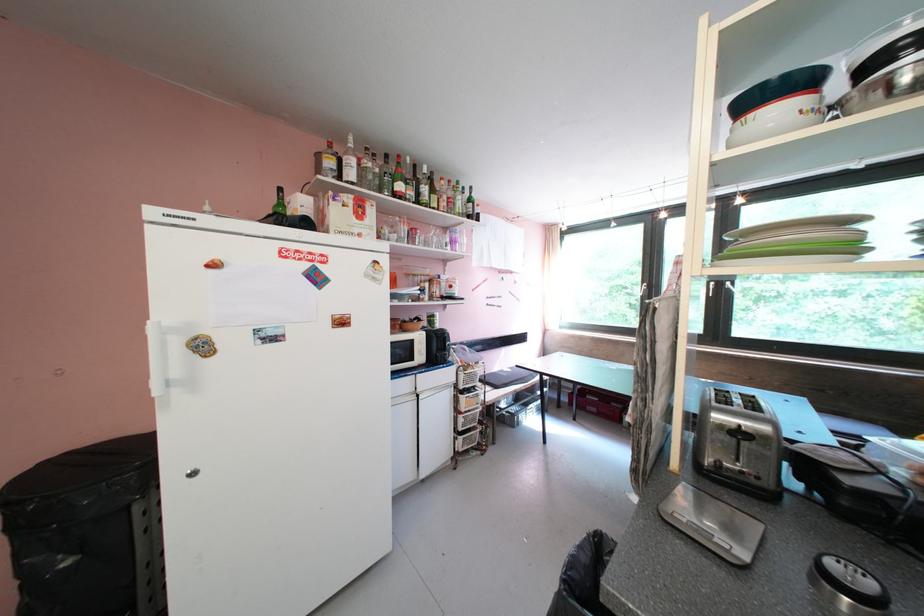
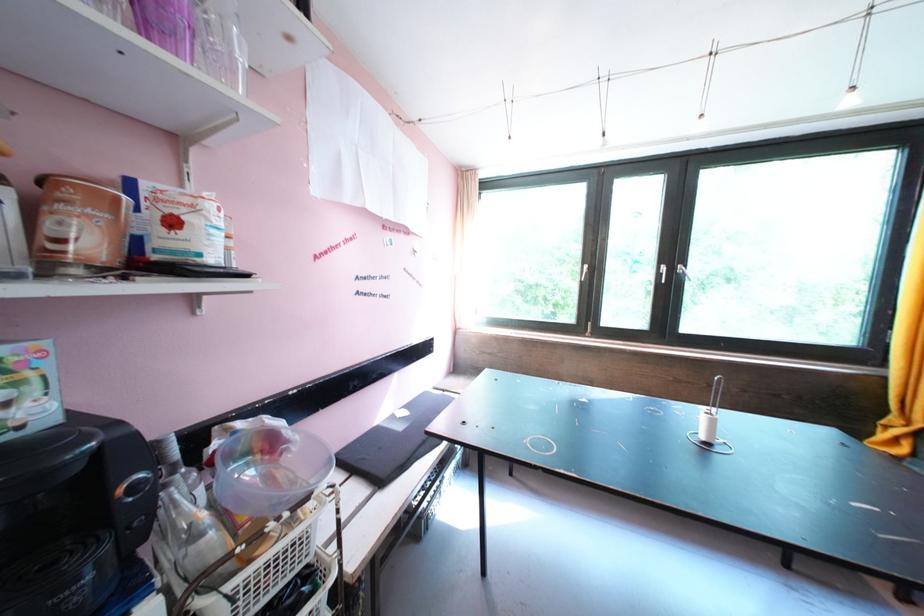
Find the pixel in the second image that matches [458,288] in the first image.

(181, 225)